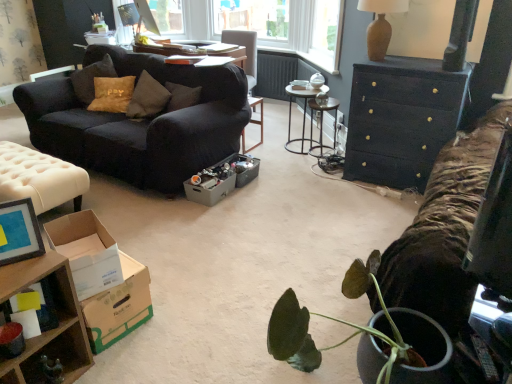
Question: Should I look upward or downward to see tufted leather ottoman at left, placed as the 2th table when sorted from back to front?

Choices:
 (A) up
 (B) down

Answer: (A)

Question: Are white cardboard box at lower left, acting as the first cardboard box starting from the front, and matte black couch at left making contact?

Choices:
 (A) no
 (B) yes

Answer: (A)

Question: Considering the relative sizes of white cardboard box at lower left, the 3th cardboard box from the back, and matte black couch at left in the image provided, is white cardboard box at lower left, the 3th cardboard box from the back, smaller than matte black couch at left?

Choices:
 (A) yes
 (B) no

Answer: (A)

Question: Does white cardboard box at lower left, the 3th cardboard box from the back, lie in front of matte black couch at left?

Choices:
 (A) yes
 (B) no

Answer: (A)

Question: From the image's perspective, is white cardboard box at lower left, the 3th cardboard box from the back, above matte black couch at left?

Choices:
 (A) yes
 (B) no

Answer: (B)

Question: Is matte black couch at left at the back of white cardboard box at lower left, acting as the first cardboard box starting from the front?

Choices:
 (A) no
 (B) yes

Answer: (A)

Question: Does white cardboard box at lower left, acting as the first cardboard box starting from the front, have a lesser width compared to matte black couch at left?

Choices:
 (A) no
 (B) yes

Answer: (B)

Question: From the image's perspective, is metallic silver table at center, the 1th table in the top-to-bottom sequence, above brown cardboard box at lower left, the 2th cardboard box in the back-to-front sequence?

Choices:
 (A) yes
 (B) no

Answer: (A)

Question: Could you tell me if metallic silver table at center, which ranks as the first table in right-to-left order, is turned towards brown cardboard box at lower left, the 2th cardboard box in the back-to-front sequence?

Choices:
 (A) no
 (B) yes

Answer: (B)

Question: From the image's perspective, is metallic silver table at center, which ranks as the third table in front-to-back order, below brown cardboard box at lower left, acting as the second cardboard box starting from the front?

Choices:
 (A) no
 (B) yes

Answer: (A)

Question: Does metallic silver table at center, which ranks as the third table in front-to-back order, have a greater height compared to brown cardboard box at lower left, the 2th cardboard box in the back-to-front sequence?

Choices:
 (A) no
 (B) yes

Answer: (B)

Question: Is metallic silver table at center, which is the 1th table in back-to-front order, in contact with brown cardboard box at lower left, acting as the second cardboard box starting from the front?

Choices:
 (A) no
 (B) yes

Answer: (A)

Question: Considering the relative sizes of metallic silver table at center, which is the 1th table in back-to-front order, and brown cardboard box at lower left, the 2th cardboard box in the back-to-front sequence, in the image provided, is metallic silver table at center, which is the 1th table in back-to-front order, shorter than brown cardboard box at lower left, the 2th cardboard box in the back-to-front sequence,?

Choices:
 (A) yes
 (B) no

Answer: (B)

Question: Is gray cardboard box at center, positioned as the third cardboard box in front-to-back order, further to the viewer compared to metallic gray box at center?

Choices:
 (A) no
 (B) yes

Answer: (A)